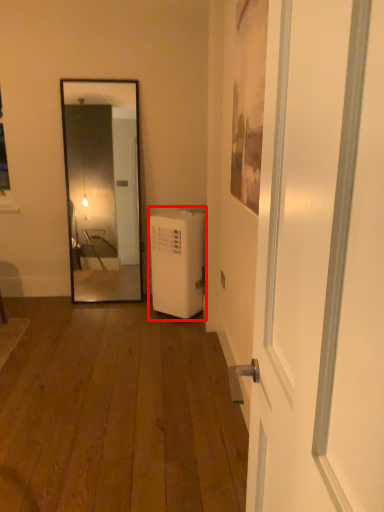
Question: Considering the relative positions of dish washer (annotated by the red box) and door in the image provided, where is dish washer (annotated by the red box) located with respect to the staircase?

Choices:
 (A) left
 (B) right

Answer: (A)